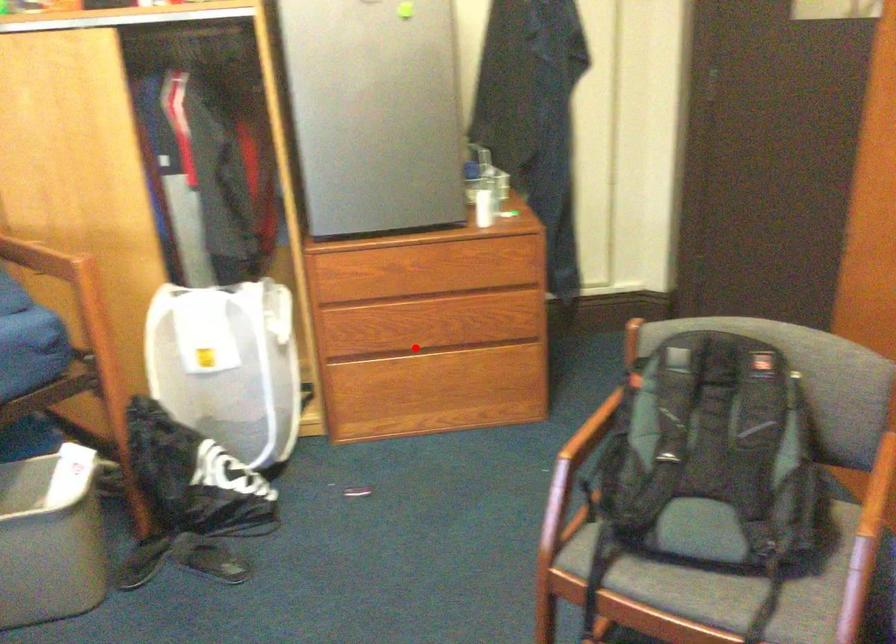
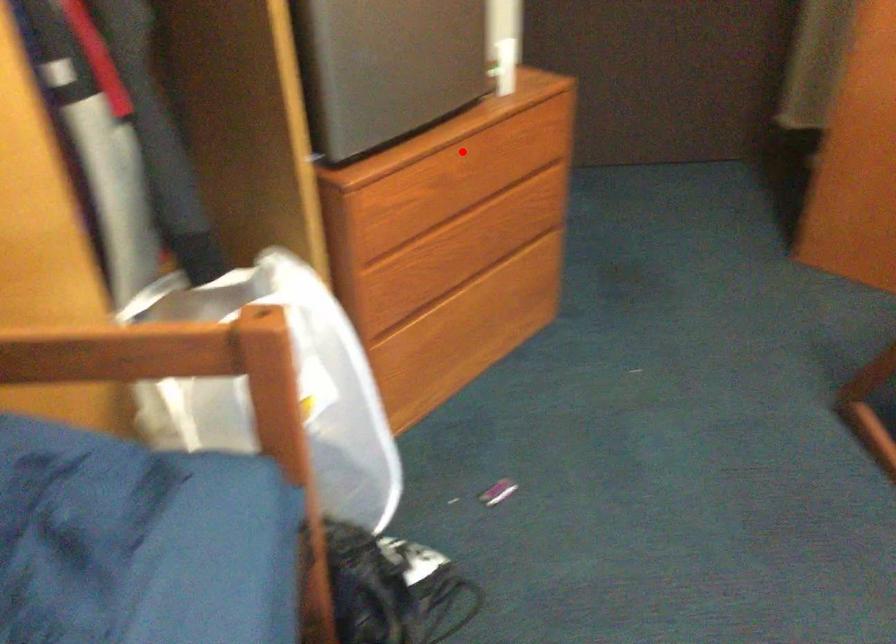
I am providing you with two images of the same scene from different viewpoints. A red point is marked on the first image and another point is marked on the second image. Does the point marked in image1 correspond to the same location as the one in image2?

No